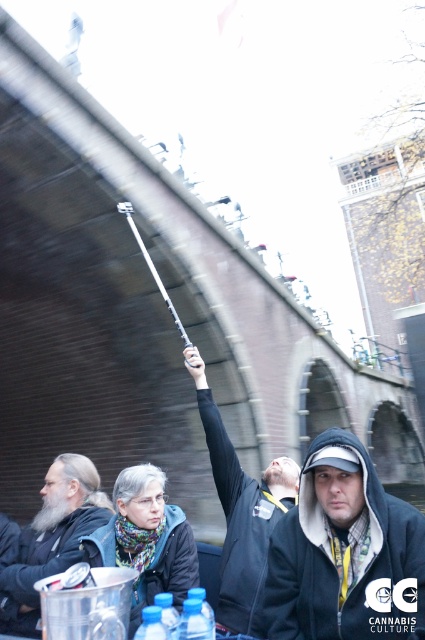
From the picture: Can you confirm if dark gray hoodie at center is shorter than bearded man at left?

No.

Does dark gray hoodie at center have a greater height compared to bearded man at left?

Yes, dark gray hoodie at center is taller than bearded man at left.

The width and height of the screenshot is (425, 640). Describe the element at coordinates (345, 552) in the screenshot. I see `dark gray hoodie at center` at that location.

Where is `dark gray hoodie at center`? Image resolution: width=425 pixels, height=640 pixels. dark gray hoodie at center is located at coordinates (345, 552).

Can you confirm if black matte jacket at upper center is positioned above bearded man at left?

Correct, black matte jacket at upper center is located above bearded man at left.

Can you confirm if black matte jacket at upper center is positioned below bearded man at left?

No, black matte jacket at upper center is not below bearded man at left.

Is point (189, 360) positioned in front of point (44, 515)?

No, it is behind (44, 515).

Find the location of `black matte jacket at upper center`. black matte jacket at upper center is located at coordinates (240, 512).

Measure the distance between dark gray hoodie at center and black matte jacket at upper center.

dark gray hoodie at center is 6.75 meters from black matte jacket at upper center.

Looking at this image, which of these two, dark gray hoodie at center or black matte jacket at upper center, stands shorter?

With less height is dark gray hoodie at center.

Based on the photo, who is more distant from viewer, (x=360, y=579) or (x=227, y=484)?

The point (x=227, y=484) is behind.

Where is `dark gray hoodie at center`? dark gray hoodie at center is located at coordinates tap(345, 552).